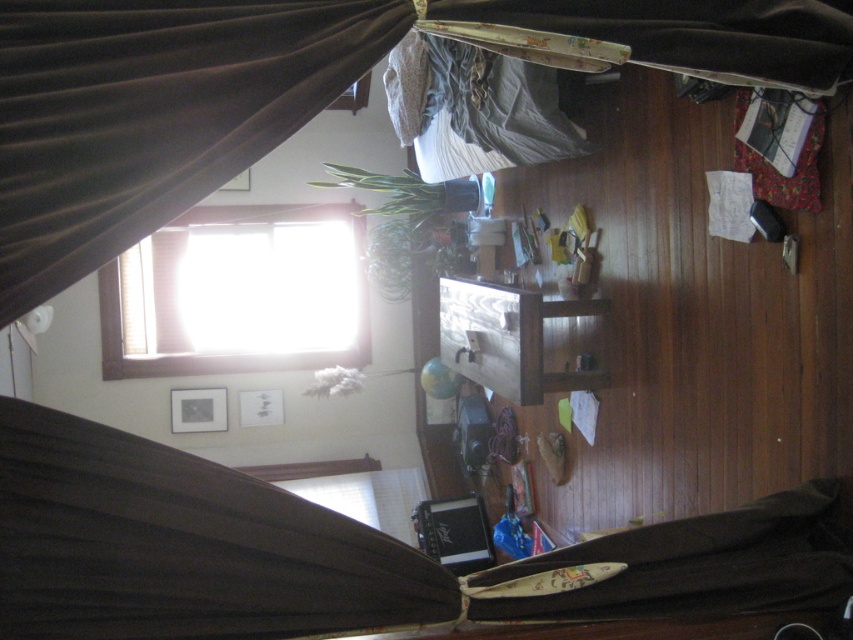
Question: Can you confirm if velvet brown curtain at upper left is thinner than transparent glass window at upper center?

Choices:
 (A) no
 (B) yes

Answer: (B)

Question: Which object is farther from the camera taking this photo?

Choices:
 (A) velvet brown curtain at upper left
 (B) transparent glass window at upper center

Answer: (B)

Question: Is velvet brown curtain at upper left smaller than transparent glass window at upper center?

Choices:
 (A) no
 (B) yes

Answer: (B)

Question: Can you confirm if velvet brown curtain at upper left is thinner than transparent glass window at upper center?

Choices:
 (A) yes
 (B) no

Answer: (A)

Question: Which point is farther to the camera?

Choices:
 (A) transparent glass window at upper center
 (B) velvet brown curtain at upper left

Answer: (A)